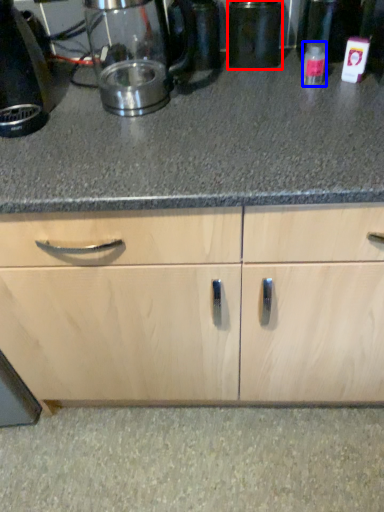
Question: Which object is further to the camera taking this photo, appliance (highlighted by a red box) or bottle (highlighted by a blue box)?

Choices:
 (A) appliance
 (B) bottle

Answer: (A)